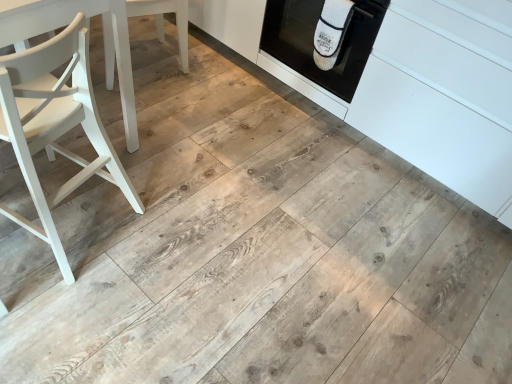
Identify the location of white matte wood chair at left, placed as the first chair when sorted from top to bottom. The height and width of the screenshot is (384, 512). (163, 18).

This screenshot has width=512, height=384. Describe the element at coordinates (414, 89) in the screenshot. I see `white matte cabinetry at center` at that location.

Describe the element at coordinates (331, 32) in the screenshot. The width and height of the screenshot is (512, 384). I see `white ribbed oven mitt at upper right` at that location.

I want to click on white matte wood chair at left, the 2th chair positioned from the front, so click(163, 18).

From the image's perspective, is white matte cabinetry at center on top of white ribbed oven mitt at upper right?

Yes.

Is white matte cabinetry at center positioned far away from white ribbed oven mitt at upper right?

No, there isn't a large distance between white matte cabinetry at center and white ribbed oven mitt at upper right.

Which object is wider, white matte cabinetry at center or white ribbed oven mitt at upper right?

With larger width is white matte cabinetry at center.

The height and width of the screenshot is (384, 512). I want to click on cabinetry above the white ribbed oven mitt at upper right (from the image's perspective), so click(x=414, y=89).

Considering the positions of objects white ribbed oven mitt at upper right and white matte cabinetry at center in the image provided, who is more to the right, white ribbed oven mitt at upper right or white matte cabinetry at center?

white matte cabinetry at center.

From the picture: Considering the sizes of white ribbed oven mitt at upper right and white matte cabinetry at center in the image, is white ribbed oven mitt at upper right taller or shorter than white matte cabinetry at center?

Clearly, white ribbed oven mitt at upper right is shorter compared to white matte cabinetry at center.

Measure the distance from white ribbed oven mitt at upper right to white matte cabinetry at center.

white ribbed oven mitt at upper right and white matte cabinetry at center are 11.23 inches apart from each other.

How many degrees apart are the facing directions of white ribbed oven mitt at upper right and white painted wood chair at left, the first chair positioned from the front?

The angular difference between white ribbed oven mitt at upper right and white painted wood chair at left, the first chair positioned from the front, is 77.6 degrees.

From the image's perspective, which one is positioned higher, white ribbed oven mitt at upper right or white painted wood chair at left, which ranks as the 2th chair in top-to-bottom order?

From the image's view, white ribbed oven mitt at upper right is above.

Considering the relative sizes of white ribbed oven mitt at upper right and white painted wood chair at left, the first chair positioned from the front, in the image provided, is white ribbed oven mitt at upper right bigger than white painted wood chair at left, the first chair positioned from the front,?

Incorrect, white ribbed oven mitt at upper right is not larger than white painted wood chair at left, the first chair positioned from the front.

Would you say white matte wood chair at left, the 2th chair positioned from the front, is inside or outside white matte cabinetry at center?

white matte wood chair at left, the 2th chair positioned from the front, is not inside white matte cabinetry at center, it's outside.

The image size is (512, 384). In the image, there is a white matte wood chair at left, which is the 2th chair from bottom to top. Find the location of `cabinetry above it (from the image's perspective)`. cabinetry above it (from the image's perspective) is located at coordinates (414, 89).

Is white matte wood chair at left, the 2th chair positioned from the front, positioned with its back to white matte cabinetry at center?

Correct, white matte wood chair at left, the 2th chair positioned from the front, is looking away from white matte cabinetry at center.

Is the position of white matte wood chair at left, which is the 2th chair from bottom to top, less distant than that of white matte cabinetry at center?

That is False.

Which is in front, point (45, 99) or point (412, 113)?

The point (45, 99) is closer.

Is white painted wood chair at left, which ranks as the 2th chair in top-to-bottom order, oriented away from white matte cabinetry at center?

No, white painted wood chair at left, which ranks as the 2th chair in top-to-bottom order,'s orientation is not away from white matte cabinetry at center.

Between white painted wood chair at left, which ranks as the 2th chair in top-to-bottom order, and white matte cabinetry at center, which one appears on the left side from the viewer's perspective?

white painted wood chair at left, which ranks as the 2th chair in top-to-bottom order.

Is white painted wood chair at left, which is counted as the 1th chair, starting from the bottom, not near white matte cabinetry at center?

Indeed, white painted wood chair at left, which is counted as the 1th chair, starting from the bottom, is not near white matte cabinetry at center.

Does white ribbed oven mitt at upper right turn towards white matte cabinetry at center?

No, white ribbed oven mitt at upper right is not facing towards white matte cabinetry at center.

Which object is positioned more to the left, white ribbed oven mitt at upper right or white matte cabinetry at center?

white ribbed oven mitt at upper right.

Is white ribbed oven mitt at upper right far from white matte cabinetry at center?

They are positioned close to each other.

Is white ribbed oven mitt at upper right bigger or smaller than white matte cabinetry at center?

white ribbed oven mitt at upper right is smaller than white matte cabinetry at center.

From the image's perspective, relative to white ribbed oven mitt at upper right, is white painted wood chair at left, the 2th chair viewed from the back, above or below?

From the image's perspective, white painted wood chair at left, the 2th chair viewed from the back, appears below white ribbed oven mitt at upper right.

Considering the positions of objects white painted wood chair at left, the first chair positioned from the front, and white ribbed oven mitt at upper right in the image provided, who is behind, white painted wood chair at left, the first chair positioned from the front, or white ribbed oven mitt at upper right?

white ribbed oven mitt at upper right.

Considering the sizes of white painted wood chair at left, which is counted as the 1th chair, starting from the bottom, and white ribbed oven mitt at upper right in the image, is white painted wood chair at left, which is counted as the 1th chair, starting from the bottom, wider or thinner than white ribbed oven mitt at upper right?

Considering their sizes, white painted wood chair at left, which is counted as the 1th chair, starting from the bottom, looks slimmer than white ribbed oven mitt at upper right.

Looking at this image, measure the distance from white painted wood chair at left, which is counted as the 1th chair, starting from the bottom, to white ribbed oven mitt at upper right.

1.20 meters.

You are a GUI agent. You are given a task and a screenshot of the screen. Output one action in this format:
    pyautogui.click(x=<x>, y=<y>)
    Task: Click on the cabinetry in front of the white ribbed oven mitt at upper right
    The height and width of the screenshot is (384, 512).
    Given the screenshot: What is the action you would take?
    pos(414,89)

I want to click on oven behind the white matte cabinetry at center, so click(313, 41).

When comparing their distances from white ribbed oven mitt at upper right, does white ribbed oven mitt at upper right or white matte wood chair at left, the 2th chair positioned from the front, seem closer?

white ribbed oven mitt at upper right lies closer to white ribbed oven mitt at upper right than the other object.

From the image, which object appears to be farther from white ribbed oven mitt at upper right, white matte wood chair at left, placed as the first chair when sorted from top to bottom, or white painted wood chair at left, which is counted as the 1th chair, starting from the bottom?

white painted wood chair at left, which is counted as the 1th chair, starting from the bottom.

From the image, which object appears to be farther from white ribbed oven mitt at upper right, white matte wood chair at left, which is the 1th chair from back to front, or white matte cabinetry at center?

Among the two, white matte wood chair at left, which is the 1th chair from back to front, is located further to white ribbed oven mitt at upper right.

Looking at the image, which one is located further to white ribbed oven mitt at upper right, white painted wood chair at left, the 2th chair viewed from the back, or white matte wood chair at left, placed as the first chair when sorted from top to bottom?

white painted wood chair at left, the 2th chair viewed from the back, is further to white ribbed oven mitt at upper right.

Estimate the real-world distances between objects in this image. Which object is further from white ribbed oven mitt at upper right, white painted wood chair at left, the first chair positioned from the front, or white matte wood chair at left, which is the 2th chair from bottom to top?

white painted wood chair at left, the first chair positioned from the front, is positioned further to the anchor white ribbed oven mitt at upper right.

Considering their positions, is white ribbed oven mitt at upper right positioned closer to white painted wood chair at left, which is counted as the 1th chair, starting from the bottom, than white ribbed oven mitt at upper right?

white ribbed oven mitt at upper right lies closer to white painted wood chair at left, which is counted as the 1th chair, starting from the bottom, than the other object.

Estimate the real-world distances between objects in this image. Which object is closer to white painted wood chair at left, which is counted as the 1th chair, starting from the bottom, white ribbed oven mitt at upper right or white matte cabinetry at center?

Based on the image, white ribbed oven mitt at upper right appears to be nearer to white painted wood chair at left, which is counted as the 1th chair, starting from the bottom.

Which object lies further to the anchor point white matte wood chair at left, which is the 1th chair from back to front, white ribbed oven mitt at upper right or white ribbed oven mitt at upper right?

white ribbed oven mitt at upper right is further to white matte wood chair at left, which is the 1th chair from back to front.

Where is `material between white painted wood chair at left, the first chair positioned from the front, and white ribbed oven mitt at upper right, in the horizontal direction`? The height and width of the screenshot is (384, 512). material between white painted wood chair at left, the first chair positioned from the front, and white ribbed oven mitt at upper right, in the horizontal direction is located at coordinates (331, 32).

I want to click on material located between white matte wood chair at left, which is the 1th chair from back to front, and white ribbed oven mitt at upper right in the left-right direction, so click(331, 32).

This screenshot has height=384, width=512. In order to click on chair between white painted wood chair at left, the 2th chair viewed from the back, and white ribbed oven mitt at upper right, in the horizontal direction in this screenshot , I will do `click(163, 18)`.

At what (x,y) coordinates should I click in order to perform the action: click on chair between white painted wood chair at left, the first chair positioned from the front, and white matte cabinetry at center from left to right. Please return your answer as a coordinate pair (x, y). This screenshot has height=384, width=512. Looking at the image, I should click on (163, 18).